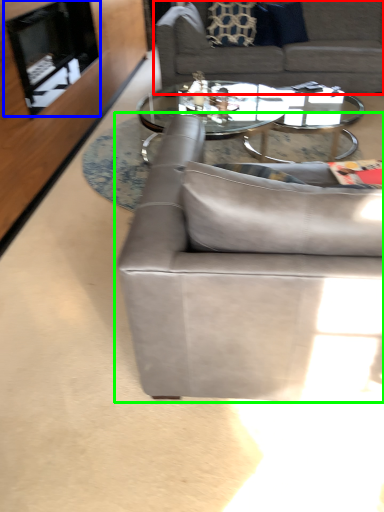
Question: Based on their relative distances, which object is nearer to studio couch (highlighted by a red box)? Choose from fireplace (highlighted by a blue box) and studio couch (highlighted by a green box).

Choices:
 (A) fireplace
 (B) studio couch

Answer: (A)